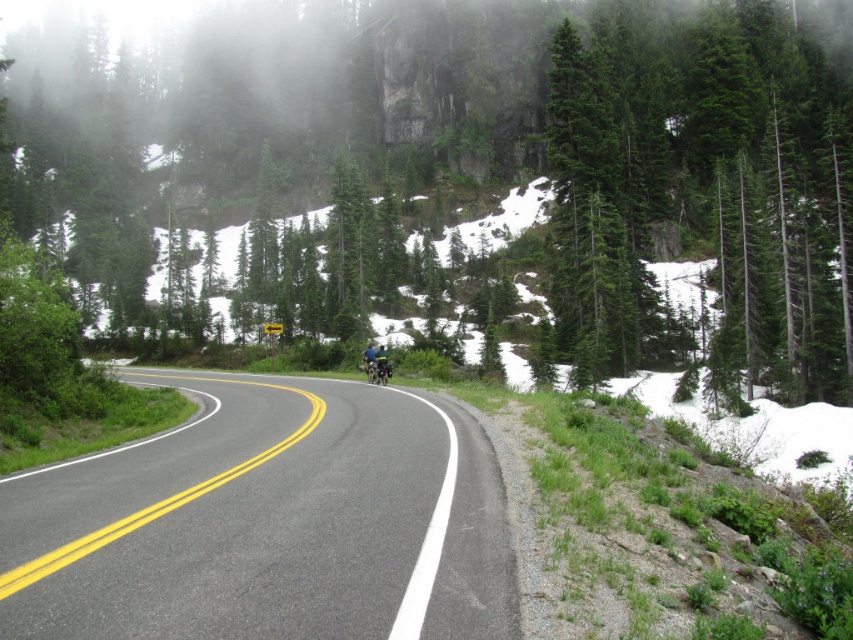
Question: Which of the following is the closest to the observer?

Choices:
 (A) (824, 32)
 (B) (401, 483)

Answer: (B)

Question: Considering the relative positions of green textured tree at center and black asphalt road at center in the image provided, where is green textured tree at center located with respect to black asphalt road at center?

Choices:
 (A) right
 (B) left

Answer: (B)

Question: Can you confirm if green textured tree at center is positioned to the left of black asphalt road at center?

Choices:
 (A) no
 (B) yes

Answer: (B)

Question: In this image, where is green textured tree at center located relative to black asphalt road at center?

Choices:
 (A) below
 (B) above

Answer: (B)

Question: Which of the following is the farthest from the observer?

Choices:
 (A) (474, 620)
 (B) (463, 29)

Answer: (B)